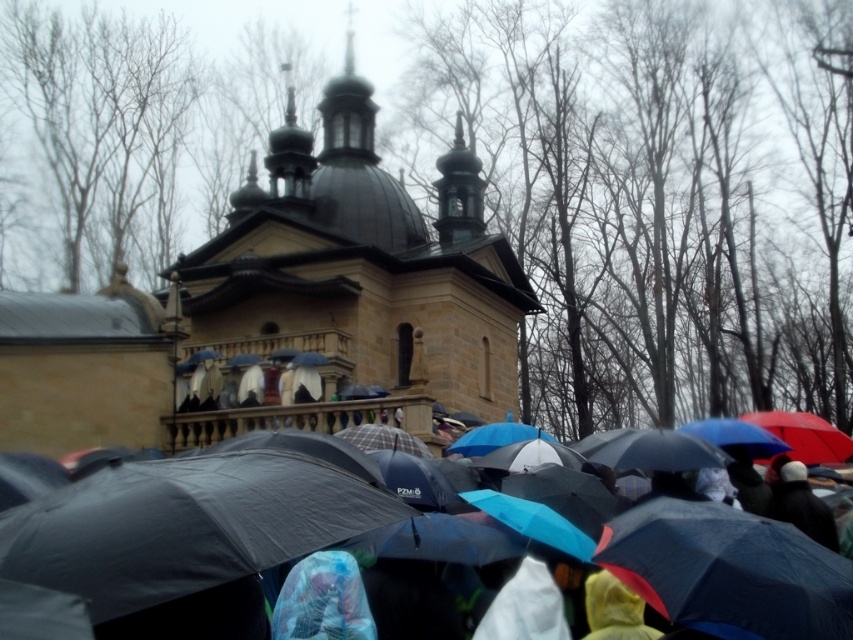
Question: Which of the following is the closest to the observer?

Choices:
 (A) tap(326, 109)
 (B) tap(137, 564)

Answer: (B)

Question: Can you confirm if brown stone church at center is positioned below matte black umbrellas at center?

Choices:
 (A) yes
 (B) no

Answer: (B)

Question: Is brown stone church at center wider than matte black umbrellas at center?

Choices:
 (A) no
 (B) yes

Answer: (B)

Question: Can you confirm if brown stone church at center is positioned to the left of matte black umbrellas at center?

Choices:
 (A) yes
 (B) no

Answer: (A)